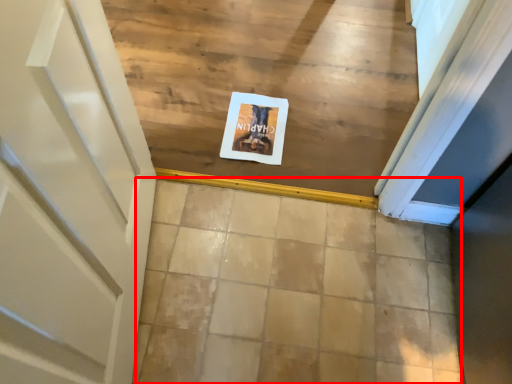
Question: Considering the relative positions of tile (annotated by the red box) and postcard in the image provided, where is tile (annotated by the red box) located with respect to the staircase?

Choices:
 (A) left
 (B) right

Answer: (B)